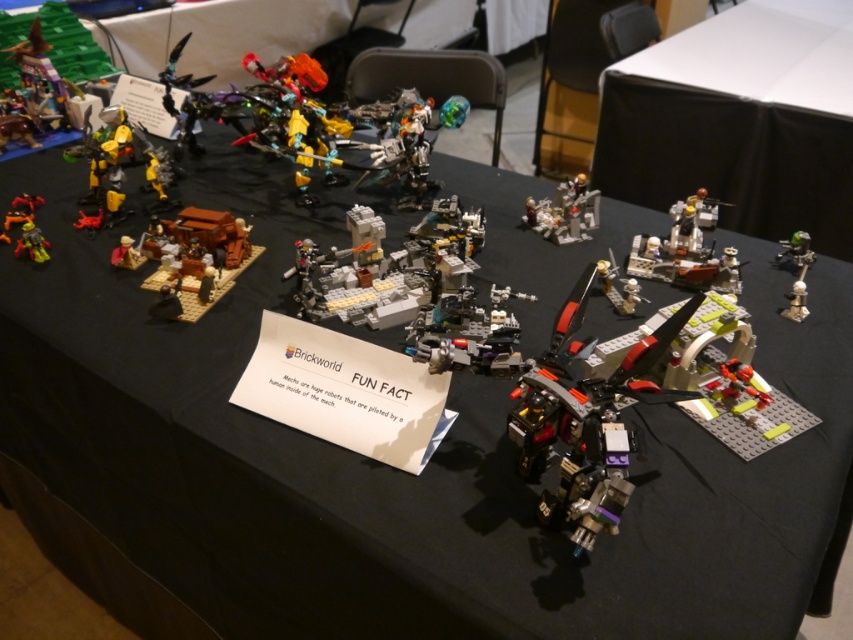
You are a guest at the LEGO event and want to take a photo of both the metallic silver robot at center and the green metallic sword at upper right. Which object will appear larger in your photo?

The metallic silver robot at center will appear larger in your photo because it is closer to you than the green metallic sword at upper right.